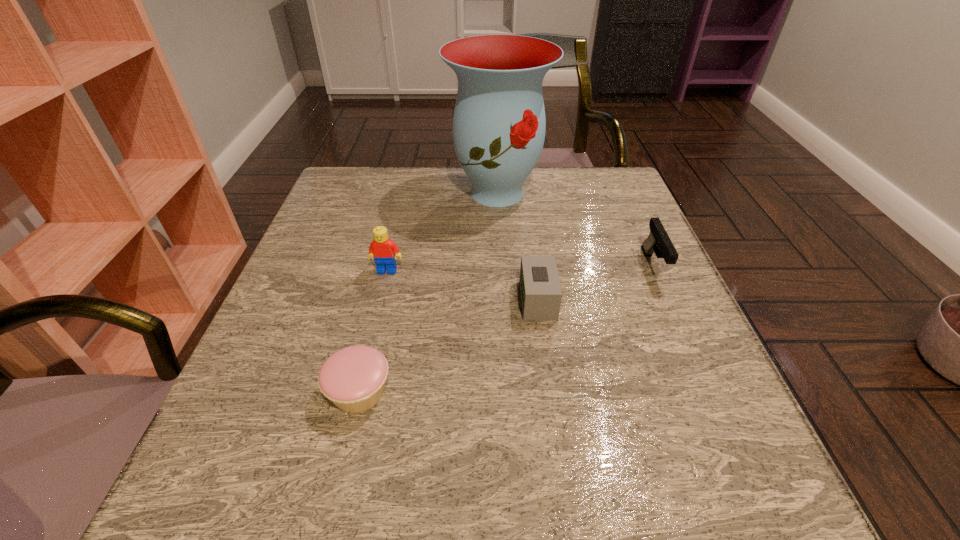
In the image, there is a desktop. Find the location of `free space at the right edge`. free space at the right edge is located at coordinates (632, 327).

Find the location of a particular element. The image size is (960, 540). vacant space at the far left corner of the desktop is located at coordinates (376, 204).

You are a GUI agent. You are given a task and a screenshot of the screen. Output one action in this format:
    pyautogui.click(x=<x>, y=<y>)
    Task: Click on the free space at the near left corner
    The height and width of the screenshot is (540, 960).
    Given the screenshot: What is the action you would take?
    pyautogui.click(x=233, y=475)

The image size is (960, 540). In the image, there is a desktop. In order to click on free space at the far right corner in this screenshot , I will do `click(591, 183)`.

Image resolution: width=960 pixels, height=540 pixels. Identify the location of free region at the near right corner of the desktop. (709, 479).

You are a GUI agent. You are given a task and a screenshot of the screen. Output one action in this format:
    pyautogui.click(x=<x>, y=<y>)
    Task: Click on the free spot between the second tallest object and the nearest object
    The height and width of the screenshot is (540, 960).
    Given the screenshot: What is the action you would take?
    pyautogui.click(x=373, y=332)

Where is `free space between the alarm clock and the cupcake`? free space between the alarm clock and the cupcake is located at coordinates (449, 346).

At what (x,y) coordinates should I click in order to perform the action: click on free point between the alarm clock and the Lego. Please return your answer as a coordinate pair (x, y). The height and width of the screenshot is (540, 960). Looking at the image, I should click on coord(463,286).

Locate an element on the screen. vacant space that is in between the third tallest object and the tallest object is located at coordinates (575, 230).

This screenshot has height=540, width=960. What are the coordinates of `free space between the farthest object and the Lego` in the screenshot? It's located at pos(442,232).